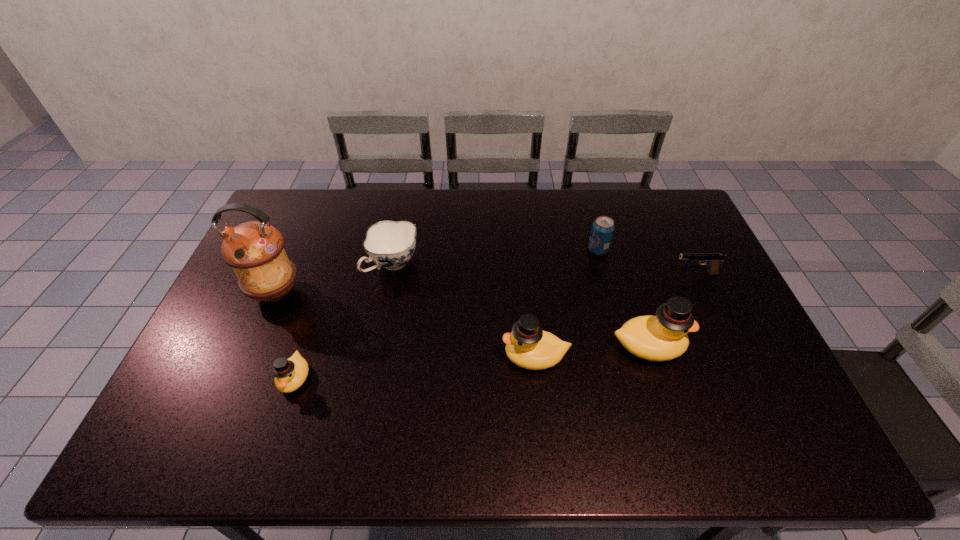
This screenshot has height=540, width=960. In the image, there is a desktop. Find the location of `blank space at the near right corner`. blank space at the near right corner is located at coordinates (766, 390).

You are a GUI agent. You are given a task and a screenshot of the screen. Output one action in this format:
    pyautogui.click(x=<x>, y=<y>)
    Task: Click on the free area in between the tallest object and the pop soda
    Image resolution: width=960 pixels, height=540 pixels.
    Given the screenshot: What is the action you would take?
    pyautogui.click(x=437, y=271)

This screenshot has height=540, width=960. I want to click on vacant space that's between the fourth object from left to right and the pop soda, so click(x=566, y=303).

The image size is (960, 540). I want to click on free space between the second object from left to right and the second shortest duck, so click(x=415, y=367).

Locate an element on the screen. The image size is (960, 540). unoccupied position between the leftmost duck and the rightmost duck is located at coordinates (471, 362).

Where is `vacant space that is in between the leftmost object and the third tallest object`? This screenshot has width=960, height=540. vacant space that is in between the leftmost object and the third tallest object is located at coordinates (405, 324).

Locate an element on the screen. The image size is (960, 540). free space between the fourth object from left to right and the pop soda is located at coordinates (566, 303).

Locate an element on the screen. The image size is (960, 540). vacant space that is in between the pop soda and the tallest object is located at coordinates (437, 271).

Identify the location of unoccupied area between the second duck from left to right and the pop soda. This screenshot has width=960, height=540. (566, 303).

Where is `free space between the oil lamp and the shortest duck`? The height and width of the screenshot is (540, 960). free space between the oil lamp and the shortest duck is located at coordinates (285, 335).